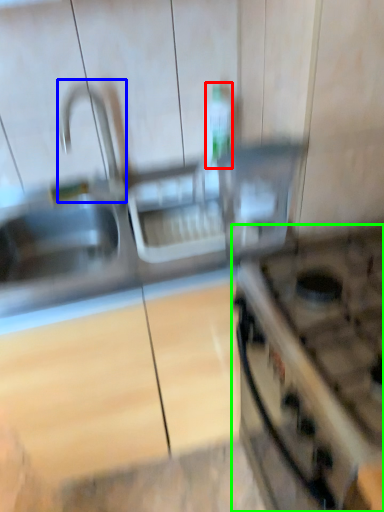
Question: Based on their relative distances, which object is nearer to bottle (highlighted by a red box)? Choose from faucet (highlighted by a blue box) and gas stove (highlighted by a green box).

Choices:
 (A) faucet
 (B) gas stove

Answer: (A)